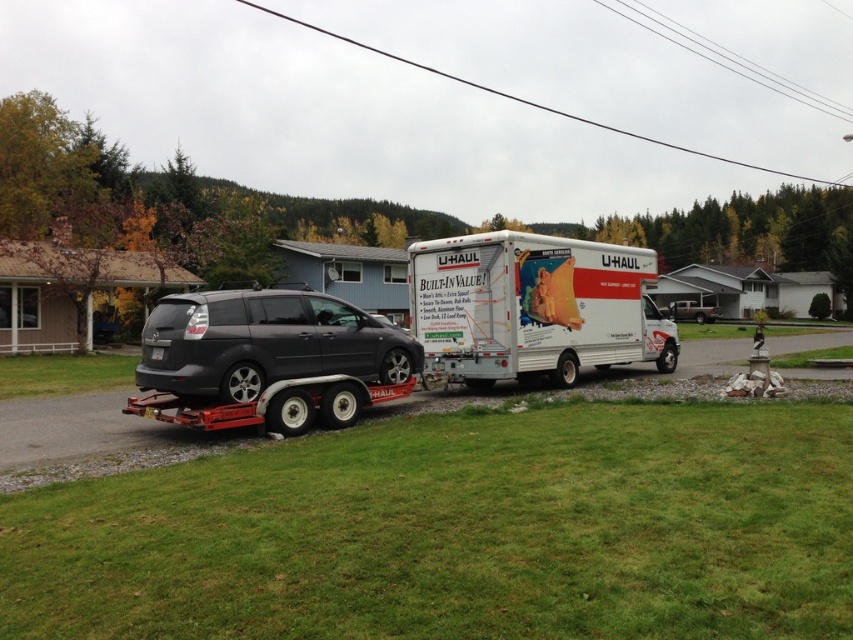
Is white matte u-haul trailer at center above matte gray minivan at center?

Indeed, white matte u-haul trailer at center is positioned over matte gray minivan at center.

Identify the location of white matte u-haul trailer at center. The width and height of the screenshot is (853, 640). (532, 307).

Find the location of a particular element. The image size is (853, 640). white matte u-haul trailer at center is located at coordinates (532, 307).